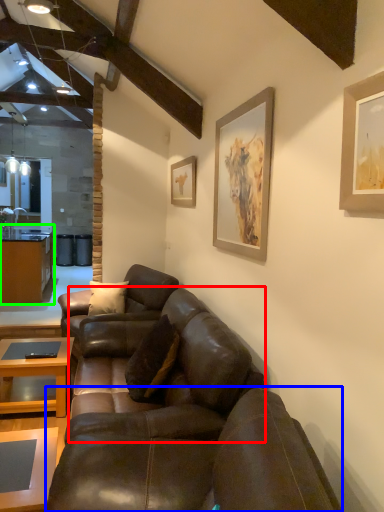
Question: Which object is the closest to the studio couch (highlighted by a red box)? Choose among these: studio couch (highlighted by a blue box) or cabinetry (highlighted by a green box).

Choices:
 (A) studio couch
 (B) cabinetry

Answer: (A)